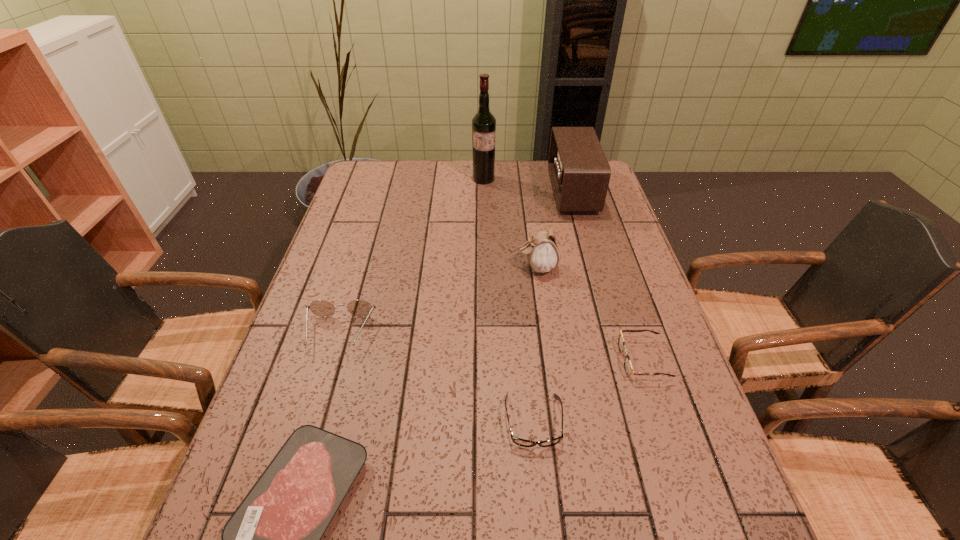
Image resolution: width=960 pixels, height=540 pixels. What are the coordinates of `vacant space positioned 0.260m on the front-facing side of the sixth shortest object` in the screenshot? It's located at (478, 191).

In order to click on vacant space located 0.300m on the front-facing side of the sixth shortest object in this screenshot , I will do `click(467, 191)`.

Where is `vacant space located on the front-facing side of the fifth nearest object`? vacant space located on the front-facing side of the fifth nearest object is located at coordinates (389, 267).

This screenshot has height=540, width=960. Find the location of `vacant space located 0.260m on the front-facing side of the fifth nearest object`. vacant space located 0.260m on the front-facing side of the fifth nearest object is located at coordinates (424, 267).

Locate an element on the screen. The height and width of the screenshot is (540, 960). free region located 0.390m on the front-facing side of the fifth nearest object is located at coordinates (378, 267).

The height and width of the screenshot is (540, 960). In order to click on blank area located 0.180m on the front-facing side of the leftmost spectacles in this screenshot , I will do `click(311, 426)`.

I want to click on vacant space located 0.140m on the frame of the rightmost spectacles, so click(561, 360).

At what (x,y) coordinates should I click in order to perform the action: click on vacant area situated 0.070m on the frame of the rightmost spectacles. Please return your answer as a coordinate pair (x, y). The image size is (960, 540). Looking at the image, I should click on (590, 360).

Find the location of a particular element. free space located 0.350m on the frame of the rightmost spectacles is located at coordinates (469, 360).

The image size is (960, 540). I want to click on free region located 0.080m on the front-facing side of the nearest spectacles, so click(540, 494).